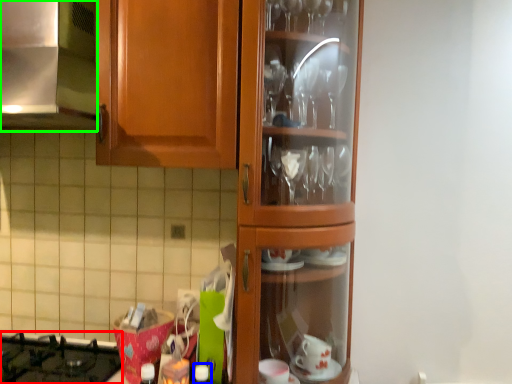
Question: Based on their relative distances, which object is nearer to gas stove (highlighted by a red box)? Choose from bottle (highlighted by a blue box) and exhaust hood (highlighted by a green box).

Choices:
 (A) bottle
 (B) exhaust hood

Answer: (A)